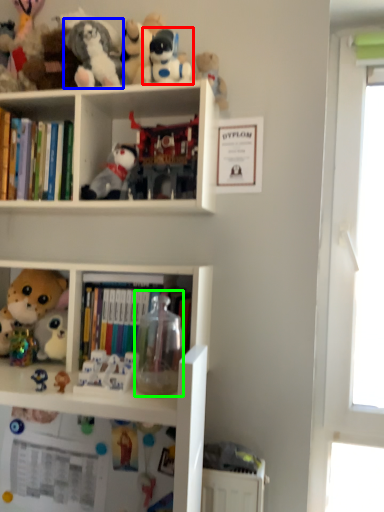
Question: Considering the real-world distances, which object is closest to toy (highlighted by a red box)? toy (highlighted by a blue box) or toy (highlighted by a green box).

Choices:
 (A) toy
 (B) toy

Answer: (A)